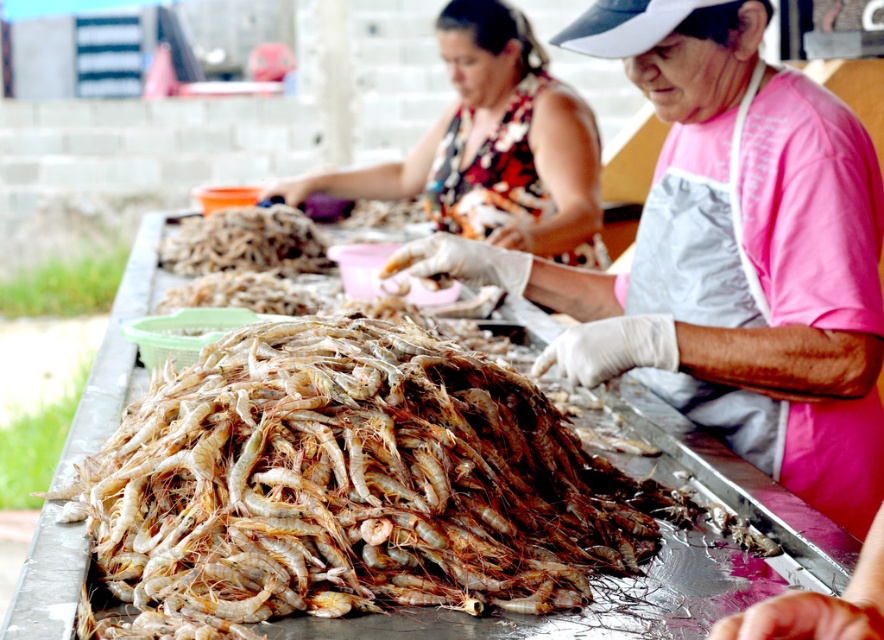
You are a customer at the seafood market and want to place a large container of shrimp on the counter. The container is wider than the printed fabric blouse at upper center. Will it fit on the counter next to the translucent plastic tray at center?

The printed fabric blouse at upper center might be wider than the translucent plastic tray at center, but since the container is wider than the blouse, it may not fit on the counter next to the tray. Check the available space carefully before placing the container.

Please provide the coordinates of the translucent white shrimp at center in the scene described.

The translucent white shrimp at center is located at coordinates point [349,486].

You are a food safety inspector and need to ensure proper food handling. The recommended minimum distance between raw seafood and any clothing is 18 inches to prevent contamination. Based on the scene, is the distance between the translucent white shrimp at center and the pink fabric apron at center compliant with this regulation?

The distance between the translucent white shrimp at center and the pink fabric apron at center is 22.02 inches, which exceeds the recommended 18 inches. Therefore, it is compliant with the regulation.